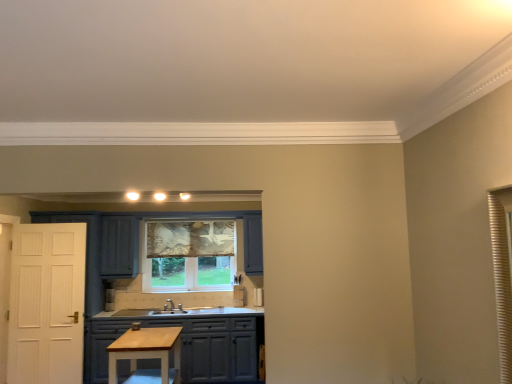
Where is `matte gray cabinets at center`? The width and height of the screenshot is (512, 384). matte gray cabinets at center is located at coordinates (188, 346).

The width and height of the screenshot is (512, 384). Describe the element at coordinates (188, 346) in the screenshot. I see `matte gray cabinets at center` at that location.

What is the approximate width of patterned fabric window at center?

It is 4.09 inches.

Locate an element on the screen. The width and height of the screenshot is (512, 384). light wood table at center is located at coordinates (147, 355).

This screenshot has width=512, height=384. Find the location of `matte gray cabinets at center`. matte gray cabinets at center is located at coordinates (188, 346).

From a real-world perspective, is patterned fabric window at center on matte gray cabinets at center?

Yes.

Does patterned fabric window at center have a smaller size compared to matte gray cabinets at center?

Yes.

From the image's perspective, is patterned fabric window at center located above matte gray cabinets at center?

Yes.

Looking at this image, in the image, is patterned fabric window at center on the left side or the right side of matte gray cabinets at center?

patterned fabric window at center is to the right of matte gray cabinets at center.

From a real-world perspective, which object rests below the other?

light wood table at center is physically lower.

Does patterned fabric window at center have a greater height compared to light wood table at center?

Indeed, patterned fabric window at center has a greater height compared to light wood table at center.

Measure the distance between patterned fabric window at center and light wood table at center.

A distance of 2.19 meters exists between patterned fabric window at center and light wood table at center.

Is point (215, 263) in front of point (181, 328)?

That is False.

Is matte gray cabinets at center oriented towards patterned fabric window at center?

No, matte gray cabinets at center is not turned towards patterned fabric window at center.

From the image's perspective, is matte gray cabinets at center over patterned fabric window at center?

No, from the image's perspective, matte gray cabinets at center is not over patterned fabric window at center.

In the image, there is a matte gray cabinets at center. Identify the location of window above it (from the image's perspective). The image size is (512, 384). [188, 256].

You are a GUI agent. You are given a task and a screenshot of the screen. Output one action in this format:
    pyautogui.click(x=<x>, y=<y>)
    Task: Click on the table in front of the matte gray cabinets at center
    
    Given the screenshot: What is the action you would take?
    pyautogui.click(x=147, y=355)

From the image's perspective, which one is positioned higher, matte gray cabinets at center or light wood table at center?

light wood table at center is shown above in the image.

Between matte gray cabinets at center and light wood table at center, which one has smaller width?

light wood table at center is thinner.

Considering the positions of point (142, 360) and point (160, 378), is point (142, 360) closer or farther from the camera than point (160, 378)?

Point (142, 360).

Which is closer to the camera, (133,365) or (216,380)?

Clearly, point (133,365) is closer to the camera than point (216,380).

Does light wood table at center have a lesser height compared to matte gray cabinets at center?

Yes, light wood table at center is shorter than matte gray cabinets at center.

Could you tell me if light wood table at center is turned towards matte gray cabinets at center?

No.

From a real-world perspective, is light wood table at center under matte gray cabinets at center?

Incorrect, from a real-world perspective, light wood table at center is higher than matte gray cabinets at center.

Considering the relative sizes of light wood table at center and patterned fabric window at center in the image provided, is light wood table at center taller than patterned fabric window at center?

No, light wood table at center is not taller than patterned fabric window at center.

Who is more distant, light wood table at center or patterned fabric window at center?

patterned fabric window at center.

Is light wood table at center to the left of patterned fabric window at center from the viewer's perspective?

Indeed, light wood table at center is positioned on the left side of patterned fabric window at center.

Locate an element on the screen. This screenshot has height=384, width=512. window on the right of light wood table at center is located at coordinates coord(188,256).

Identify the location of window above the matte gray cabinets at center (from the image's perspective). (188, 256).

Find the location of a particular element. window lying behind the light wood table at center is located at coordinates (188, 256).

Based on their spatial positions, is patterned fabric window at center or light wood table at center further from matte gray cabinets at center?

patterned fabric window at center lies further to matte gray cabinets at center than the other object.

Based on the photo, from the image, which object appears to be nearer to light wood table at center, patterned fabric window at center or matte gray cabinets at center?

The object closer to light wood table at center is matte gray cabinets at center.

Based on their spatial positions, is light wood table at center or matte gray cabinets at center further from patterned fabric window at center?

Among the two, light wood table at center is located further to patterned fabric window at center.

Based on their spatial positions, is matte gray cabinets at center or light wood table at center further from patterned fabric window at center?

The object further to patterned fabric window at center is light wood table at center.

In the scene shown: From the image, which object appears to be nearer to matte gray cabinets at center, light wood table at center or patterned fabric window at center?

The object closer to matte gray cabinets at center is light wood table at center.

Which object lies nearer to the anchor point light wood table at center, matte gray cabinets at center or patterned fabric window at center?

matte gray cabinets at center.

Where is `cabinetry between light wood table at center and patterned fabric window at center along the z-axis`? The height and width of the screenshot is (384, 512). cabinetry between light wood table at center and patterned fabric window at center along the z-axis is located at coordinates (188, 346).